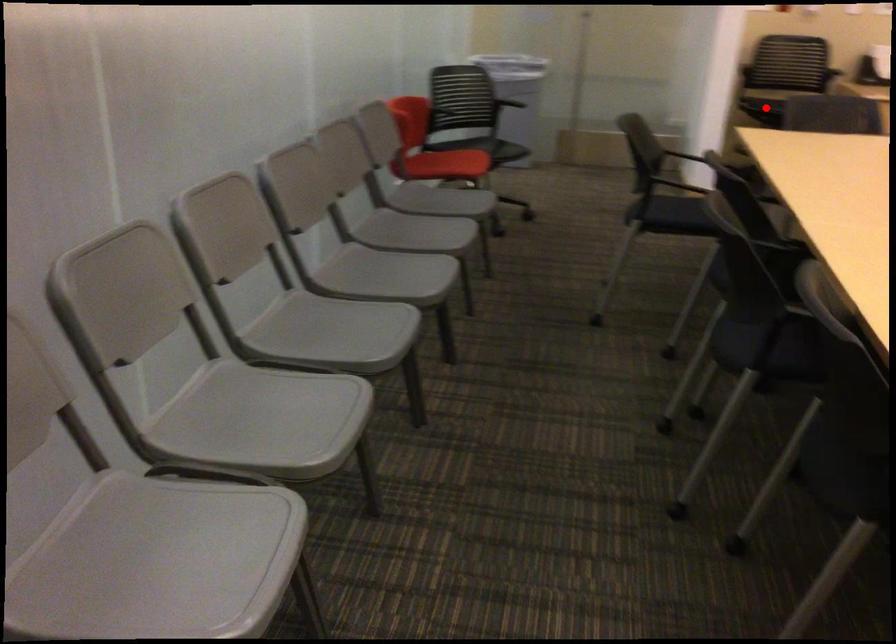
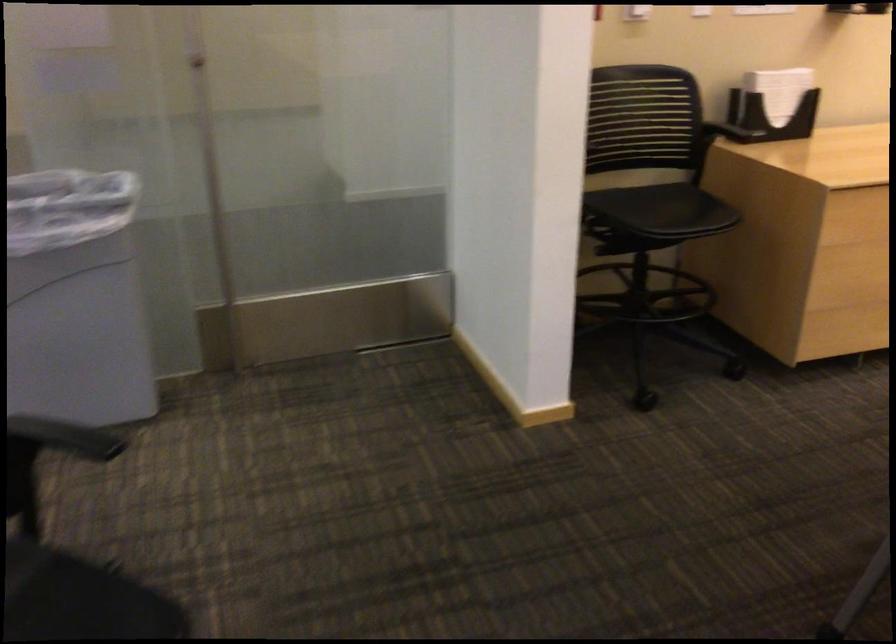
Question: I am providing you with two images of the same scene from different viewpoints. A red point is marked on the first image. Is the red point's position out of view in image 2?

Choices:
 (A) Yes
 (B) No

Answer: (A)